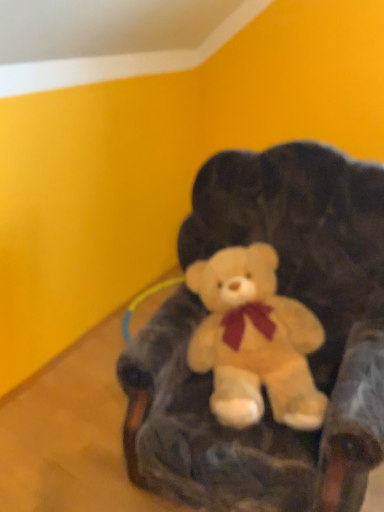
Question: Should I look upward or downward to see velvety dark brown bean bag chair at center?

Choices:
 (A) down
 (B) up

Answer: (A)

Question: Can you confirm if soft plush teddy bear at center is smaller than velvety dark brown bean bag chair at center?

Choices:
 (A) yes
 (B) no

Answer: (A)

Question: From the image's perspective, does soft plush teddy bear at center appear higher than velvety dark brown bean bag chair at center?

Choices:
 (A) yes
 (B) no

Answer: (B)

Question: Is soft plush teddy bear at center thinner than velvety dark brown bean bag chair at center?

Choices:
 (A) no
 (B) yes

Answer: (B)

Question: Can you confirm if soft plush teddy bear at center is shorter than velvety dark brown bean bag chair at center?

Choices:
 (A) no
 (B) yes

Answer: (B)

Question: Is soft plush teddy bear at center at the right side of velvety dark brown bean bag chair at center?

Choices:
 (A) yes
 (B) no

Answer: (B)

Question: From the image's perspective, does soft plush teddy bear at center appear lower than velvety dark brown bean bag chair at center?

Choices:
 (A) no
 (B) yes

Answer: (B)

Question: From the image's perspective, is velvety dark brown bean bag chair at center on soft plush teddy bear at center?

Choices:
 (A) no
 (B) yes

Answer: (B)

Question: Is velvety dark brown bean bag chair at center to the left of soft plush teddy bear at center from the viewer's perspective?

Choices:
 (A) no
 (B) yes

Answer: (A)

Question: From the image's perspective, is velvety dark brown bean bag chair at center located beneath soft plush teddy bear at center?

Choices:
 (A) yes
 (B) no

Answer: (B)

Question: Does velvety dark brown bean bag chair at center have a smaller size compared to soft plush teddy bear at center?

Choices:
 (A) no
 (B) yes

Answer: (A)

Question: Does velvety dark brown bean bag chair at center have a lesser height compared to soft plush teddy bear at center?

Choices:
 (A) yes
 (B) no

Answer: (B)

Question: Could you tell me if velvety dark brown bean bag chair at center is turned towards soft plush teddy bear at center?

Choices:
 (A) no
 (B) yes

Answer: (B)

Question: From the image's perspective, is soft plush teddy bear at center located above or below velvety dark brown bean bag chair at center?

Choices:
 (A) above
 (B) below

Answer: (B)